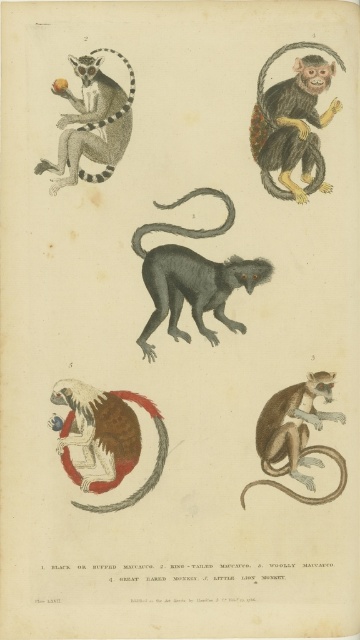
Does brown fur monkey at center have a larger size compared to brown textured monkey at lower right?

Yes.

Find the location of a particular element. This screenshot has width=360, height=640. brown fur monkey at center is located at coordinates (105, 440).

Where is `brown fur monkey at center`? brown fur monkey at center is located at coordinates (105, 440).

Is point (99, 176) farther from camera compared to point (306, 474)?

Yes, point (99, 176) is behind point (306, 474).

From the picture: Can you confirm if ring-tailed lemur at upper left is positioned below brown textured monkey at lower right?

No.

The width and height of the screenshot is (360, 640). Find the location of `ring-tailed lemur at upper left`. ring-tailed lemur at upper left is located at coordinates (92, 122).

What are the coordinates of `ring-tailed lemur at upper left` in the screenshot? It's located at (92, 122).

Is point (149, 317) farther from viewer compared to point (186, 200)?

No, it is in front of (186, 200).

Who is more distant from viewer, (201, 330) or (222, 198)?

The point (222, 198) is behind.

You are a GUI agent. You are given a task and a screenshot of the screen. Output one action in this format:
    pyautogui.click(x=<x>, y=<y>)
    Task: Click on the gray matte monkey at center
    Image resolution: width=360 pixels, height=640 pixels.
    Given the screenshot: What is the action you would take?
    pyautogui.click(x=192, y=276)